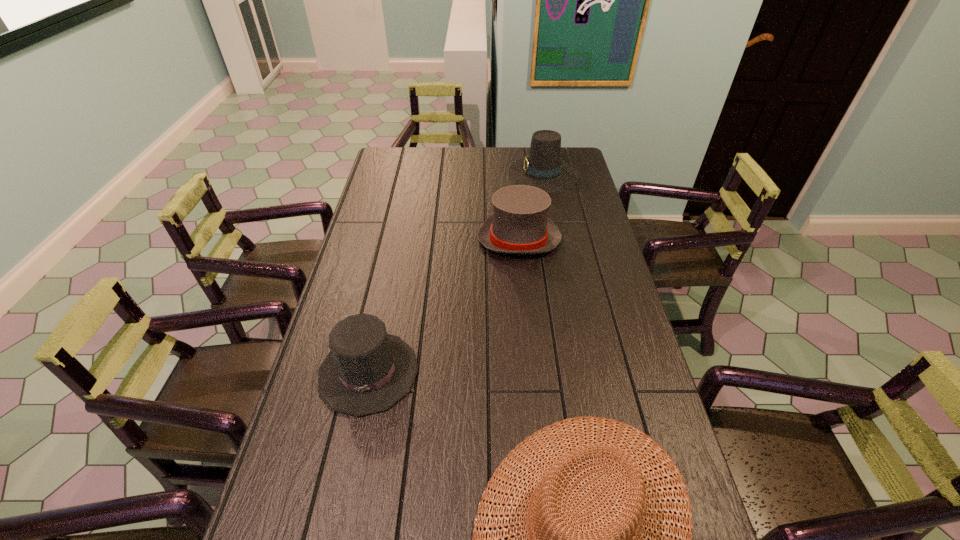
The height and width of the screenshot is (540, 960). Find the location of `dress hat that is the closest one to the second farthest dress hat`. dress hat that is the closest one to the second farthest dress hat is located at coordinates (543, 168).

Select which dress hat appears as the second closest to the farthest object. Please provide its 2D coordinates. Your answer should be formatted as a tuple, i.e. [(x, y)], where the tuple contains the x and y coordinates of a point satisfying the conditions above.

[(367, 371)]

Identify the location of free location that satisfies the following two spatial constraints: 1. on the front-facing side of the farthest dress hat; 2. on the front of the leftmost dress hat with the decoration. (581, 372).

Image resolution: width=960 pixels, height=540 pixels. Identify the location of vacant area that satisfies the following two spatial constraints: 1. on the front-facing side of the farthest dress hat; 2. on the front of the leftmost object with the decoration. point(581,372).

At what (x,y) coordinates should I click in order to perform the action: click on free location that satisfies the following two spatial constraints: 1. on the front-facing side of the farthest dress hat; 2. on the front of the leftmost object with the decoration. Please return your answer as a coordinate pair (x, y). Looking at the image, I should click on click(581, 372).